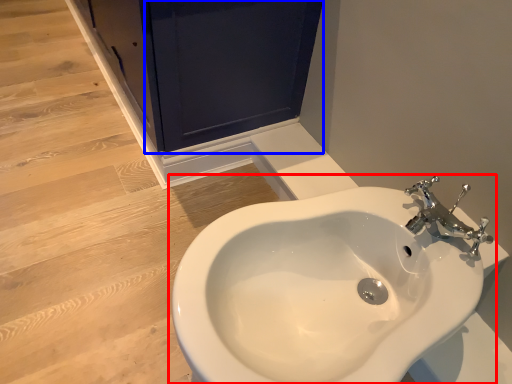
Question: Which of the following is the farthest to the observer, sink (highlighted by a red box) or screen door (highlighted by a blue box)?

Choices:
 (A) sink
 (B) screen door

Answer: (B)